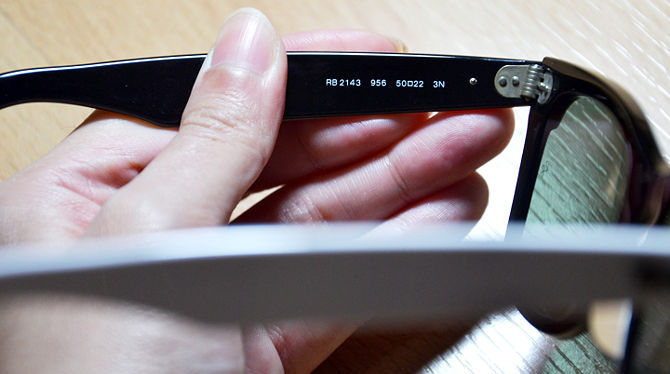
Identify the location of light brown wood background surface. The image size is (670, 374). (19, 37), (98, 43), (374, 14), (569, 28), (658, 90).